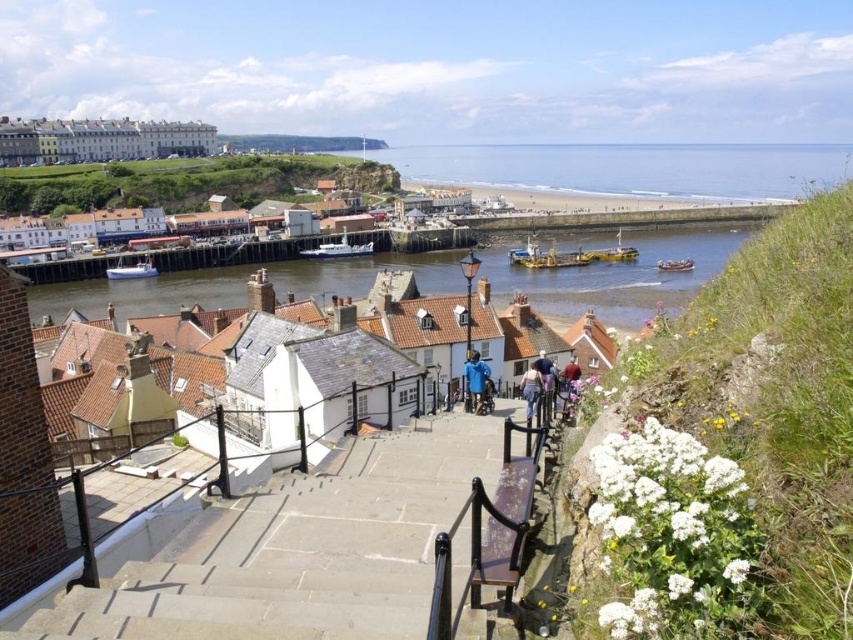
You are a photographer planning to take a photo of the light brown leather jacket at center and the wooden boat at center. Since you want both objects to be clearly visible in the frame, which object should you ensure is closer to the camera to avoid being cut off?

The light brown leather jacket at center occupies less space than the wooden boat at center, so you should ensure the wooden boat at center is closer to the camera to avoid it being cut off.

You are standing at the top of the stone steps overlooking the village. You see the smooth stone buildings at upper left and the white plastic boat at lower left. Which object is positioned further to the left side of the scene?

The smooth stone buildings at upper left are positioned further to the left side of the scene than the white plastic boat at lower left.